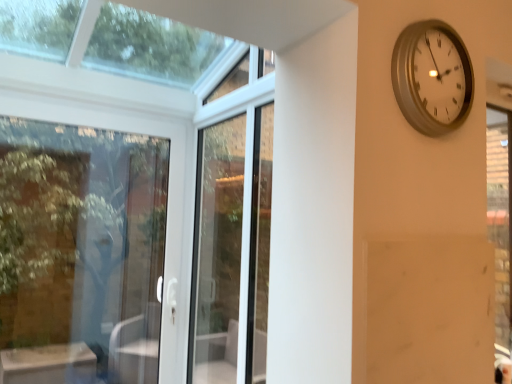
Question: Does silver metallic clock at upper right have a greater height compared to clear glass door at left?

Choices:
 (A) yes
 (B) no

Answer: (B)

Question: Does silver metallic clock at upper right have a smaller size compared to clear glass door at left?

Choices:
 (A) no
 (B) yes

Answer: (B)

Question: Is silver metallic clock at upper right oriented towards clear glass door at left?

Choices:
 (A) no
 (B) yes

Answer: (A)

Question: Can you confirm if silver metallic clock at upper right is bigger than clear glass door at left?

Choices:
 (A) no
 (B) yes

Answer: (A)

Question: Is silver metallic clock at upper right positioned behind clear glass door at left?

Choices:
 (A) no
 (B) yes

Answer: (A)

Question: From the image's perspective, does silver metallic clock at upper right appear lower than clear glass door at left?

Choices:
 (A) yes
 (B) no

Answer: (B)

Question: Could you tell me if clear glass door at left is facing silver metallic clock at upper right?

Choices:
 (A) yes
 (B) no

Answer: (A)

Question: Considering the relative sizes of clear glass door at left and silver metallic clock at upper right in the image provided, is clear glass door at left smaller than silver metallic clock at upper right?

Choices:
 (A) no
 (B) yes

Answer: (A)

Question: Does clear glass door at left have a greater width compared to silver metallic clock at upper right?

Choices:
 (A) yes
 (B) no

Answer: (A)

Question: Is clear glass door at left thinner than silver metallic clock at upper right?

Choices:
 (A) yes
 (B) no

Answer: (B)

Question: Is the depth of clear glass door at left greater than that of silver metallic clock at upper right?

Choices:
 (A) no
 (B) yes

Answer: (B)

Question: Is clear glass door at left outside silver metallic clock at upper right?

Choices:
 (A) no
 (B) yes

Answer: (B)

Question: Is clear glass door at left positioned beyond the bounds of white glass screen door at center?

Choices:
 (A) yes
 (B) no

Answer: (A)